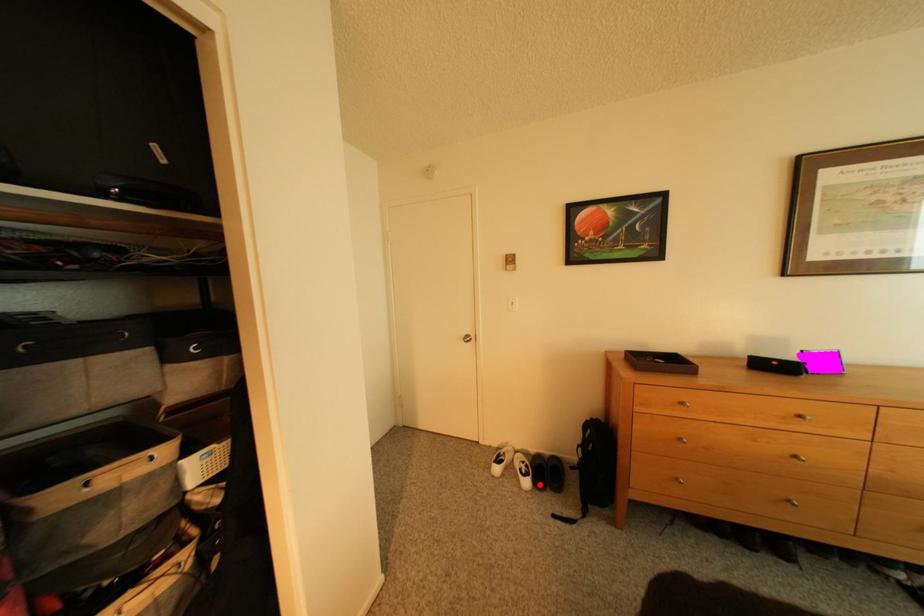
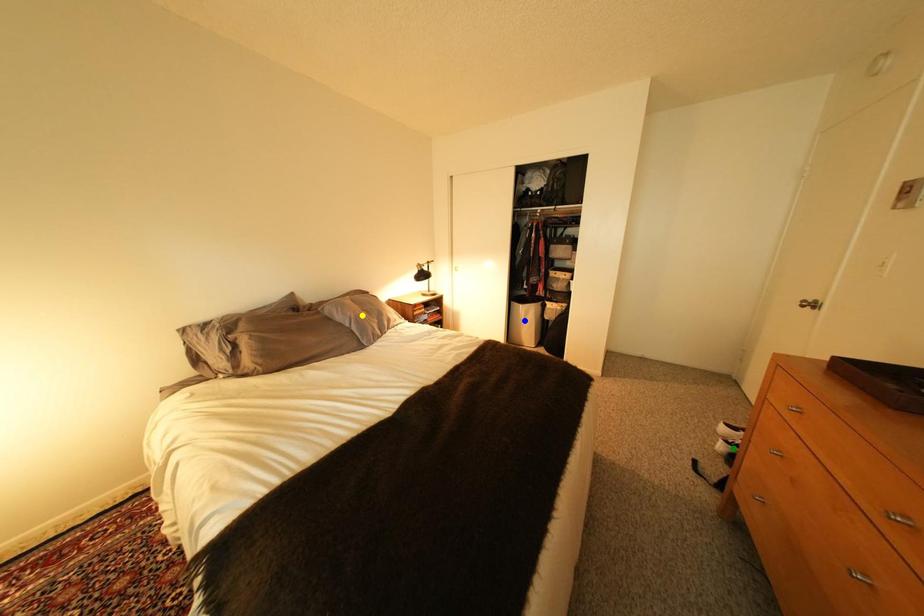
Question: I am providing you with two images of the same scene from different viewpoints. A red point is marked on the first image. You are given multiple points on the second image. Can you choose the point in image 2 that corresponds to the point in image 1?

Choices:
 (A) blue point
 (B) yellow point
 (C) green point

Answer: (C)